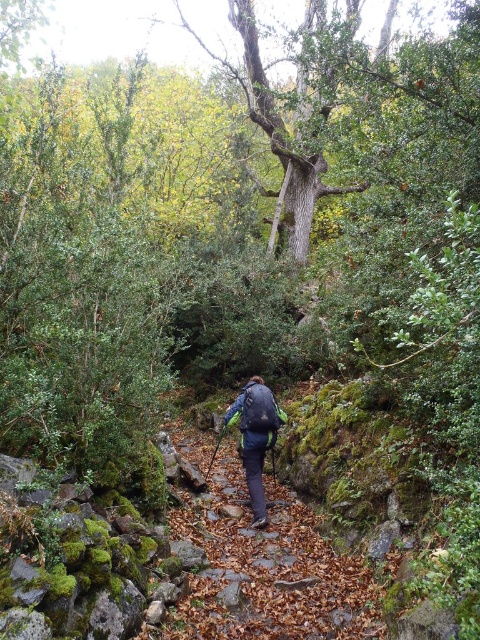
Looking at this image, you are a hiker trying to walk on the brown leafy trail at center while carrying the matte blue backpack at center. Do you think the trail is wide enough for you to walk comfortably without the backpack touching the sides?

The brown leafy trail at center is wider than the matte blue backpack at center, so yes, the trail is wide enough for the hiker to walk comfortably without the backpack touching the sides.

Looking at this image, you are a hiker planning to walk along the brown leafy trail at center while carrying the green fabric backpack at center. Can you walk comfortably without the backpack interfering with the trail?

The brown leafy trail at center is not as tall as green fabric backpack at center, so the backpack might hit the trail or block your view, making it difficult to walk comfortably.